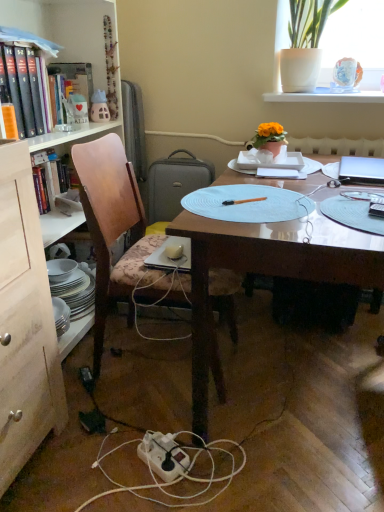
The height and width of the screenshot is (512, 384). In order to click on free area in between white plastic power outlet at lower center and white plastic power plugs and sockets at lower center, which ranks as the 2th power plugs and sockets in top-to-bottom order in this screenshot , I will do `click(120, 441)`.